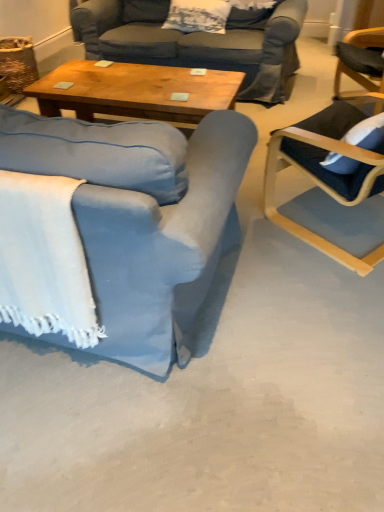
The width and height of the screenshot is (384, 512). What are the coordinates of `vacant area that is in front of dark blue fabric chair at right, the 2th chair when ordered from left to right` in the screenshot? It's located at (317, 312).